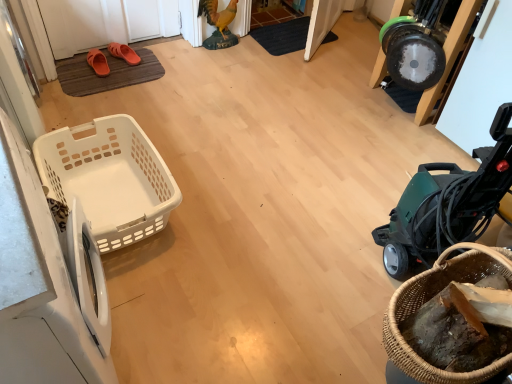
Where is `green plastic vacuum cleaner at right`? green plastic vacuum cleaner at right is located at coordinates (448, 203).

Identify the location of white plastic basket at left, the 2th basket in the right-to-left sequence. (109, 178).

Measure the distance between point (470, 247) and camera.

Point (470, 247) and camera are 3.86 feet apart from each other.

Identify the location of black textured doormat at center, marked as the 1th doormat in a back-to-front arrangement. (283, 36).

The image size is (512, 384). What do you see at coordinates (98, 62) in the screenshot?
I see `orange rubber slipper at upper left, which is the second footwear from right to left` at bounding box center [98, 62].

What do you see at coordinates (124, 53) in the screenshot? I see `orange rubber sandals at upper left, acting as the 2th footwear starting from the left` at bounding box center [124, 53].

Measure the distance between orange rubber sandals at upper left, the first footwear from the right, and camera.

orange rubber sandals at upper left, the first footwear from the right, is 8.64 feet away from camera.

The height and width of the screenshot is (384, 512). I want to click on white plastic washing machine at left, which is the first washing machine in right-to-left order, so click(88, 277).

Between point (98, 50) and point (117, 55), which one is positioned behind?

The point (98, 50) is more distant.

From the image's perspective, relative to orange rubber sandals at upper left, the first footwear from the right, is orange rubber slipper at upper left, placed as the 1th footwear when sorted from left to right, above or below?

From the image's perspective, orange rubber slipper at upper left, placed as the 1th footwear when sorted from left to right, appears below orange rubber sandals at upper left, the first footwear from the right.

How many degrees apart are the facing directions of orange rubber slipper at upper left, placed as the 1th footwear when sorted from left to right, and orange rubber sandals at upper left, acting as the 2th footwear starting from the left?

The angular difference between orange rubber slipper at upper left, placed as the 1th footwear when sorted from left to right, and orange rubber sandals at upper left, acting as the 2th footwear starting from the left, is 11.1 degrees.

Considering their positions, is orange rubber slipper at upper left, placed as the 1th footwear when sorted from left to right, located in front of or behind orange rubber sandals at upper left, acting as the 2th footwear starting from the left?

Clearly, orange rubber slipper at upper left, placed as the 1th footwear when sorted from left to right, is in front of orange rubber sandals at upper left, acting as the 2th footwear starting from the left.

From the picture: From their relative heights in the image, would you say orange rubber sandals at upper left, the first footwear from the right, is taller or shorter than black textured doormat at center, arranged as the second doormat when viewed from the left?

Clearly, orange rubber sandals at upper left, the first footwear from the right, is taller compared to black textured doormat at center, arranged as the second doormat when viewed from the left.

Is point (124, 51) positioned after point (281, 45)?

No, (124, 51) is closer to viewer.

Considering the relative positions of orange rubber sandals at upper left, acting as the 2th footwear starting from the left, and black textured doormat at center, the 2th doormat positioned from the front, in the image provided, is orange rubber sandals at upper left, acting as the 2th footwear starting from the left, to the left or to the right of black textured doormat at center, the 2th doormat positioned from the front,?

orange rubber sandals at upper left, acting as the 2th footwear starting from the left, is positioned on black textured doormat at center, the 2th doormat positioned from the front,'s left side.

From a real-world perspective, which is physically above, orange rubber sandals at upper left, acting as the 2th footwear starting from the left, or black textured doormat at center, marked as the 1th doormat in a back-to-front arrangement?

orange rubber sandals at upper left, acting as the 2th footwear starting from the left, is physically above.

Is white plastic basket at left, the first basket viewed from the back, positioned beyond the bounds of brown rubber doormat at upper left, which is the first doormat from left to right?

Absolutely, white plastic basket at left, the first basket viewed from the back, is external to brown rubber doormat at upper left, which is the first doormat from left to right.

Is white plastic basket at left, the 1th basket viewed from the left, touching brown rubber doormat at upper left, positioned as the first doormat in front-to-back order?

There is a gap between white plastic basket at left, the 1th basket viewed from the left, and brown rubber doormat at upper left, positioned as the first doormat in front-to-back order.

Is point (83, 129) closer to viewer compared to point (77, 80)?

That is True.

Between orange rubber slipper at upper left, which is the second footwear from right to left, and white plastic washing machine at left, which appears as the second washing machine when viewed from the left, which one is positioned behind?

orange rubber slipper at upper left, which is the second footwear from right to left, is behind.

Between orange rubber slipper at upper left, placed as the 1th footwear when sorted from left to right, and white plastic washing machine at left, which appears as the second washing machine when viewed from the left, which one has more height?

Standing taller between the two is white plastic washing machine at left, which appears as the second washing machine when viewed from the left.

Between point (100, 71) and point (78, 242), which one is positioned behind?

Positioned behind is point (100, 71).

Can you confirm if orange rubber slipper at upper left, placed as the 1th footwear when sorted from left to right, is thinner than white plastic washing machine at left, which appears as the second washing machine when viewed from the left?

In fact, orange rubber slipper at upper left, placed as the 1th footwear when sorted from left to right, might be wider than white plastic washing machine at left, which appears as the second washing machine when viewed from the left.

Does point (256, 40) come in front of point (104, 279)?

No, it is behind (104, 279).

Is black textured doormat at center, the 2th doormat positioned from the front, far from white plastic washing machine at left, which is the first washing machine in right-to-left order?

Yes, black textured doormat at center, the 2th doormat positioned from the front, is far from white plastic washing machine at left, which is the first washing machine in right-to-left order.

From the image's perspective, does black textured doormat at center, arranged as the second doormat when viewed from the left, appear lower than white plastic washing machine at left, which is the first washing machine in right-to-left order?

Incorrect, from the image's perspective, black textured doormat at center, arranged as the second doormat when viewed from the left, is higher than white plastic washing machine at left, which is the first washing machine in right-to-left order.

Between black textured doormat at center, arranged as the second doormat when viewed from the left, and white plastic washing machine at left, which appears as the second washing machine when viewed from the left, which one has smaller width?

Thinner between the two is white plastic washing machine at left, which appears as the second washing machine when viewed from the left.

Locate an element on the screen. basket that is the 2nd object to the left of the green plastic vacuum cleaner at right, starting at the anchor is located at coordinates (109, 178).

From a real-world perspective, is green plastic vacuum cleaner at right beneath white plastic basket at left, the 2th basket in the right-to-left sequence?

No, from a real-world perspective, green plastic vacuum cleaner at right is not below white plastic basket at left, the 2th basket in the right-to-left sequence.

Which of these two, green plastic vacuum cleaner at right or white plastic basket at left, the first basket viewed from the back, stands taller?

With more height is green plastic vacuum cleaner at right.

In the scene shown: Is orange rubber slipper at upper left, which is the second footwear from right to left, facing away from white plastic washing machine at left, marked as the second washing machine in a right-to-left arrangement?

orange rubber slipper at upper left, which is the second footwear from right to left, is not turned away from white plastic washing machine at left, marked as the second washing machine in a right-to-left arrangement.

From the image's perspective, is orange rubber slipper at upper left, which is the second footwear from right to left, beneath white plastic washing machine at left, marked as the second washing machine in a right-to-left arrangement?

No, from the image's perspective, orange rubber slipper at upper left, which is the second footwear from right to left, is not beneath white plastic washing machine at left, marked as the second washing machine in a right-to-left arrangement.

In the scene shown: Considering the relative positions of orange rubber slipper at upper left, which is the second footwear from right to left, and white plastic washing machine at left, marked as the second washing machine in a right-to-left arrangement, in the image provided, is orange rubber slipper at upper left, which is the second footwear from right to left, in front of white plastic washing machine at left, marked as the second washing machine in a right-to-left arrangement,?

No, the depth of orange rubber slipper at upper left, which is the second footwear from right to left, is greater than that of white plastic washing machine at left, marked as the second washing machine in a right-to-left arrangement.

This screenshot has width=512, height=384. Find the location of `footwear in front of the orange rubber sandals at upper left, acting as the 2th footwear starting from the left`. footwear in front of the orange rubber sandals at upper left, acting as the 2th footwear starting from the left is located at coordinates (98, 62).

Identify the location of doormat that appears above the orange rubber sandals at upper left, the first footwear from the right (from the image's perspective). This screenshot has height=384, width=512. (283, 36).

From the image, which object appears to be nearer to brown rubber doormat at upper left, positioned as the first doormat in front-to-back order, green plastic vacuum cleaner at right or white plastic washing machine at left, marked as the second washing machine in a right-to-left arrangement?

Among the two, white plastic washing machine at left, marked as the second washing machine in a right-to-left arrangement, is located nearer to brown rubber doormat at upper left, positioned as the first doormat in front-to-back order.

From the image, which object appears to be farther from green plastic vacuum cleaner at right, brown rubber doormat at upper left, positioned as the 2th doormat in top-to-bottom order, or orange rubber sandals at upper left, the first footwear from the right?

orange rubber sandals at upper left, the first footwear from the right.

Considering their positions, is green plastic vacuum cleaner at right positioned closer to woven brown basket at lower right, which is the first basket from front to back, than black textured doormat at center, which is the first doormat in top-to-bottom order?

green plastic vacuum cleaner at right is closer to woven brown basket at lower right, which is the first basket from front to back.

Estimate the real-world distances between objects in this image. Which object is further from white plastic washing machine at left, which appears as the second washing machine when viewed from the left, white plastic basket at left, the first basket viewed from the back, or black textured doormat at center, arranged as the second doormat when viewed from the left?

Based on the image, black textured doormat at center, arranged as the second doormat when viewed from the left, appears to be further to white plastic washing machine at left, which appears as the second washing machine when viewed from the left.

When comparing their distances from woven brown basket at lower right, which is the first basket from front to back, does black textured doormat at center, arranged as the second doormat when viewed from the left, or white plastic washing machine at left, which is the first washing machine in right-to-left order, seem closer?

The object closer to woven brown basket at lower right, which is the first basket from front to back, is white plastic washing machine at left, which is the first washing machine in right-to-left order.

Which object lies nearer to the anchor point green plastic vacuum cleaner at right, brown rubber doormat at upper left, marked as the second doormat in a back-to-front arrangement, or woven brown basket at lower right, which ranks as the 2th basket in back-to-front order?

woven brown basket at lower right, which ranks as the 2th basket in back-to-front order.

Which object lies nearer to the anchor point black textured doormat at center, marked as the 1th doormat in a back-to-front arrangement, brown rubber doormat at upper left, marked as the second doormat in a back-to-front arrangement, or orange rubber sandals at upper left, the first footwear from the right?

The object closer to black textured doormat at center, marked as the 1th doormat in a back-to-front arrangement, is orange rubber sandals at upper left, the first footwear from the right.

From the image, which object appears to be farther from white plastic basket at left, the 1th basket viewed from the left, green plastic vacuum cleaner at right or orange rubber slipper at upper left, which is the second footwear from right to left?

The object further to white plastic basket at left, the 1th basket viewed from the left, is green plastic vacuum cleaner at right.

Where is `baby carriage between woven brown basket at lower right, marked as the second basket in a left-to-right arrangement, and orange rubber sandals at upper left, the first footwear from the right, along the z-axis`? baby carriage between woven brown basket at lower right, marked as the second basket in a left-to-right arrangement, and orange rubber sandals at upper left, the first footwear from the right, along the z-axis is located at coordinates (448, 203).

Find the location of a particular element. baby carriage between white plastic washing machine at left, marked as the second washing machine in a right-to-left arrangement, and brown rubber doormat at upper left, positioned as the first doormat in front-to-back order, from front to back is located at coordinates (448, 203).

Image resolution: width=512 pixels, height=384 pixels. In order to click on baby carriage between white plastic washing machine at left, which appears as the second washing machine when viewed from the left, and orange rubber slipper at upper left, placed as the 1th footwear when sorted from left to right, in the front-back direction in this screenshot , I will do `click(448, 203)`.

Find the location of a particular element. doormat located between white plastic washing machine at left, which appears as the second washing machine when viewed from the left, and orange rubber sandals at upper left, acting as the 2th footwear starting from the left, in the depth direction is located at coordinates (108, 75).